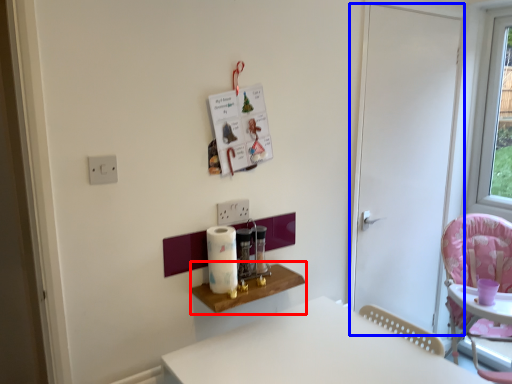
Question: Which object is closer to the camera taking this photo, table (highlighted by a red box) or door (highlighted by a blue box)?

Choices:
 (A) table
 (B) door

Answer: (A)